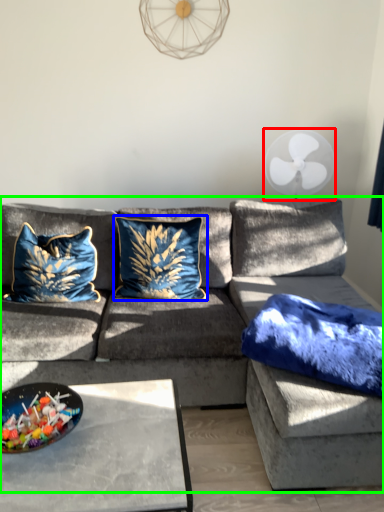
Question: Which object is the closest to the mechanical fan (highlighted by a red box)? Choose among these: pillow (highlighted by a blue box) or studio couch (highlighted by a green box).

Choices:
 (A) pillow
 (B) studio couch

Answer: (B)